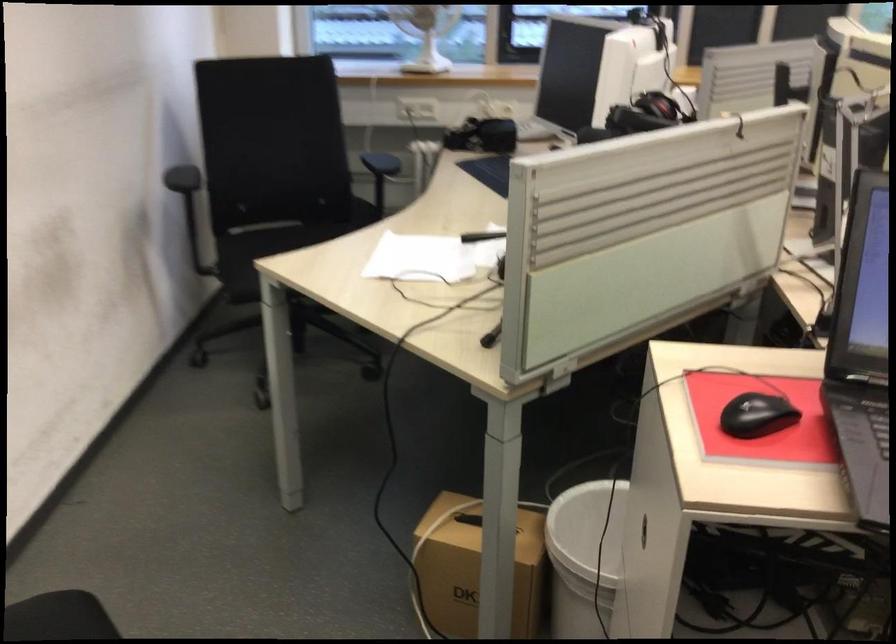
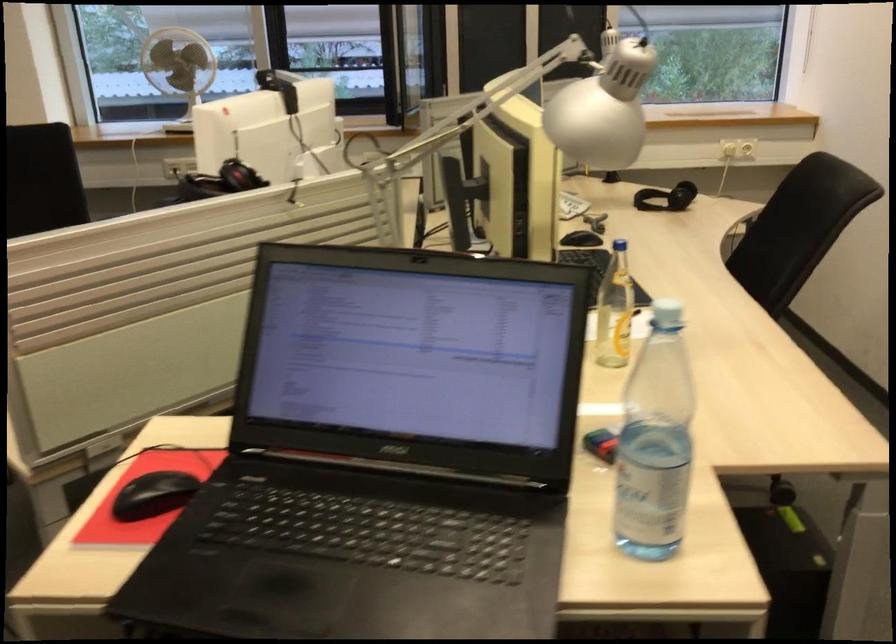
Question: The images are taken continuously from a first-person perspective. In which direction is your viewpoint rotating?

Choices:
 (A) Left
 (B) Right
 (C) Up
 (D) Down

Answer: (B)